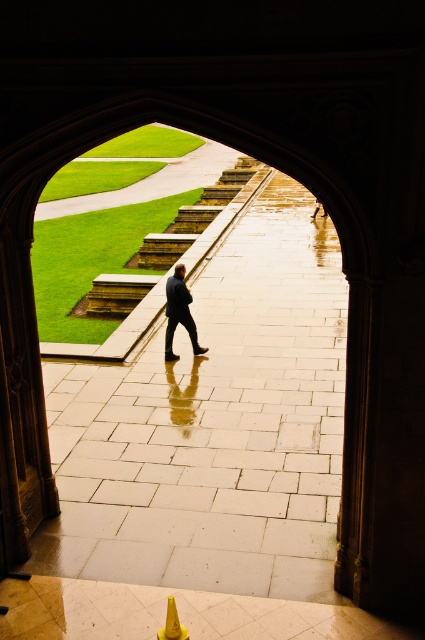
You are a photographer planning to capture the scene through the arched doorway. You want to ensure that both the light gray stone pavement at center and the dark blue suit at center are clearly visible in your photo. Given their sizes, which object will occupy more space in the final image?

The light gray stone pavement at center will occupy more space in the final image because it has a larger size compared to the dark blue suit at center.

You are a delivery person with a cart that is 1.5 meters wide. You need to move from the yellow plastic traffic cone at lower center to the light gray stone pavement at center. Is there enough space between them for your cart to pass through?

The distance between the yellow plastic traffic cone at lower center and the light gray stone pavement at center is 4.16 meters. Since your cart is only 1.5 meters wide, there is sufficient space for it to pass through.